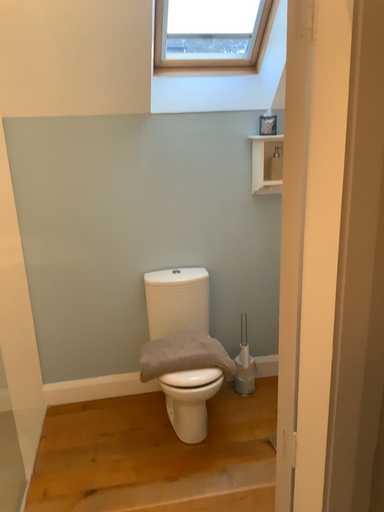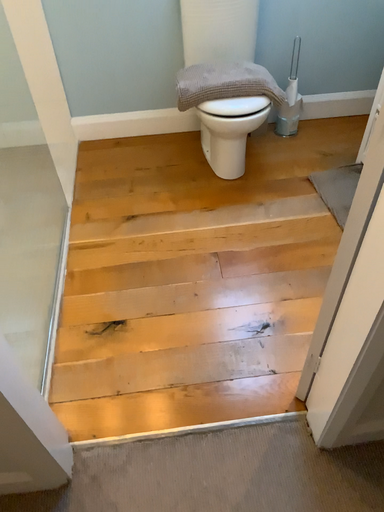
Question: Which way did the camera rotate in the video?

Choices:
 (A) rotated downward
 (B) rotated upward

Answer: (A)